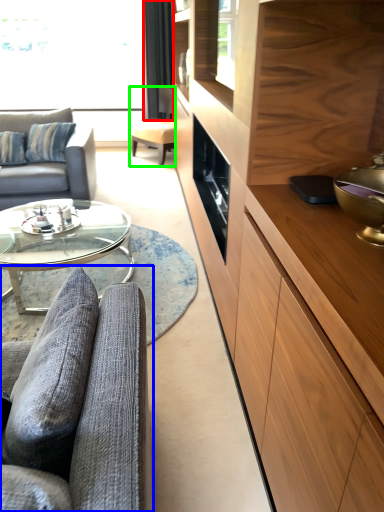
Question: Based on their relative distances, which object is nearer to curtain (highlighted by a red box)? Choose from studio couch (highlighted by a blue box) and swivel chair (highlighted by a green box).

Choices:
 (A) studio couch
 (B) swivel chair

Answer: (B)